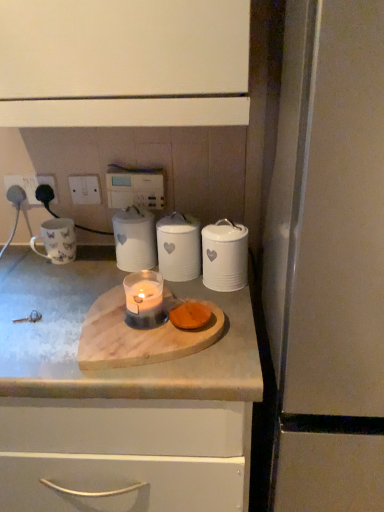
The width and height of the screenshot is (384, 512). What are the coordinates of `free space in front of white ceramic canister at center, the 1th kitchen appliance viewed from the left` in the screenshot? It's located at (104, 290).